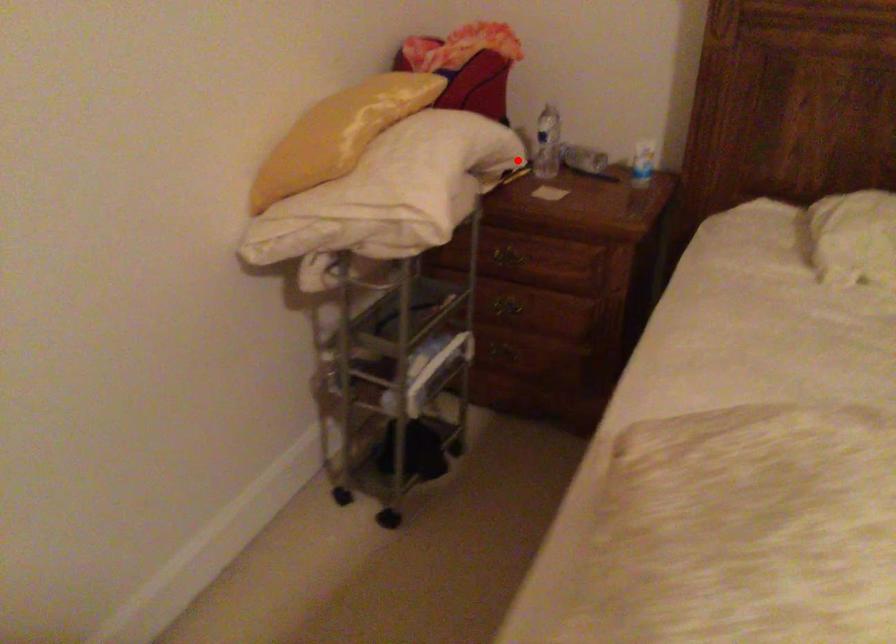
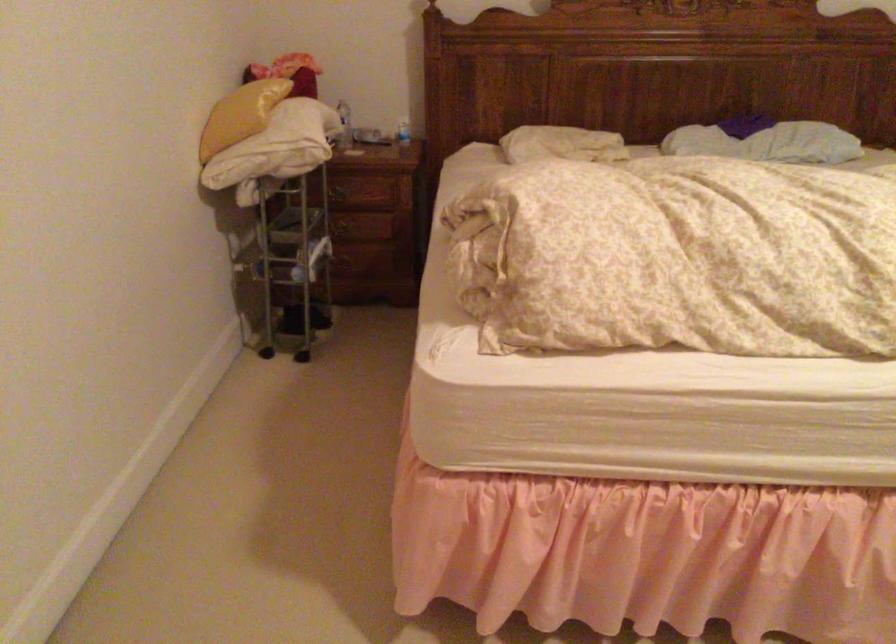
Question: I am providing you with two images of the same scene from different viewpoints. Given a red point in image1, look at the same physical point in image2. Is it:

Choices:
 (A) Closer to the viewpoint
 (B) Farther from the viewpoint

Answer: (B)